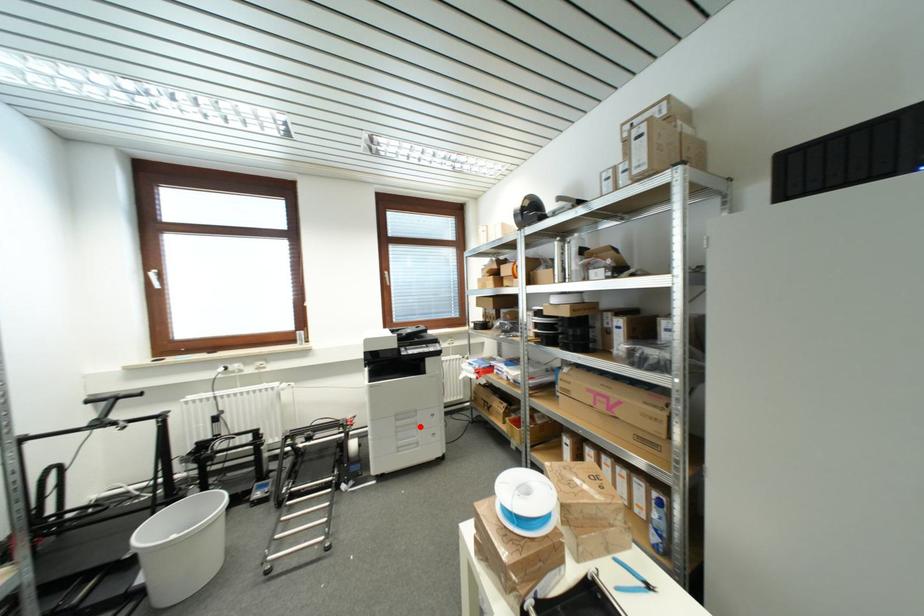
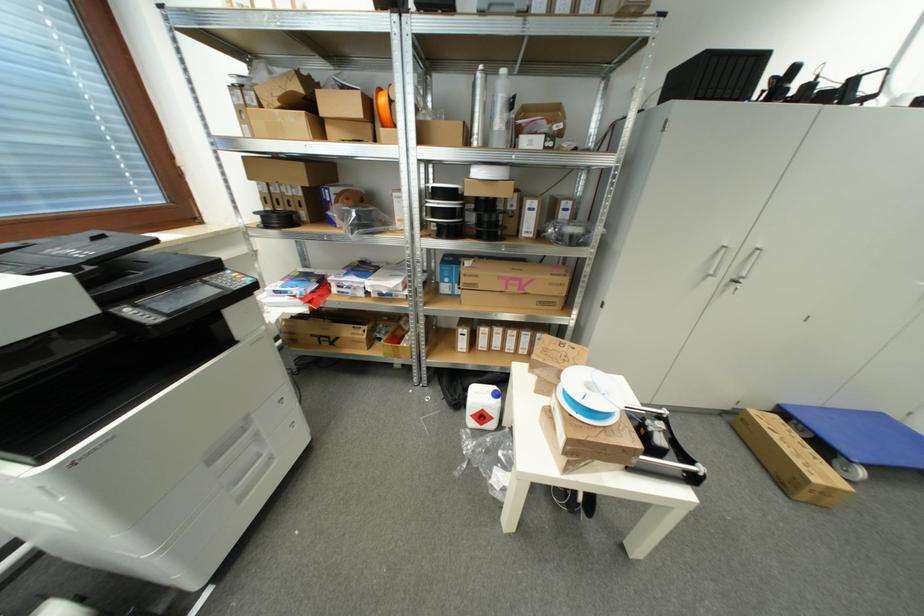
Find the pixel in the second image that matches the highlighted location in the first image.

(261, 438)